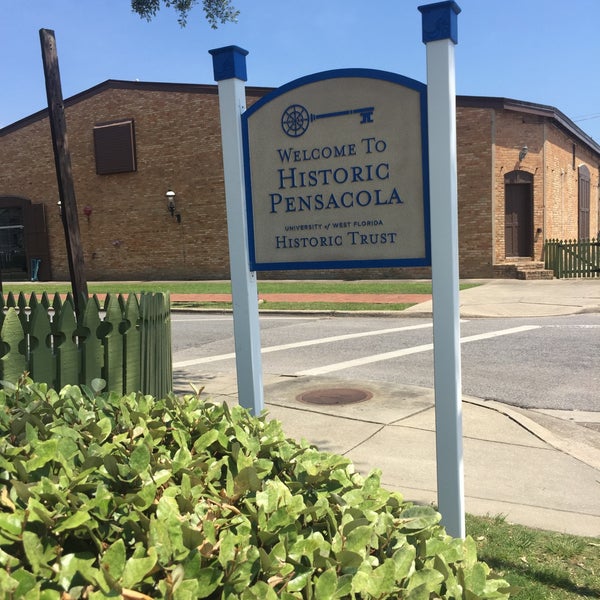
You are a GUI agent. You are given a task and a screenshot of the screen. Output one action in this format:
    pyautogui.click(x=<x>, y=<y>)
    Task: Click on the stairs
    
    Given the screenshot: What is the action you would take?
    [541, 267]